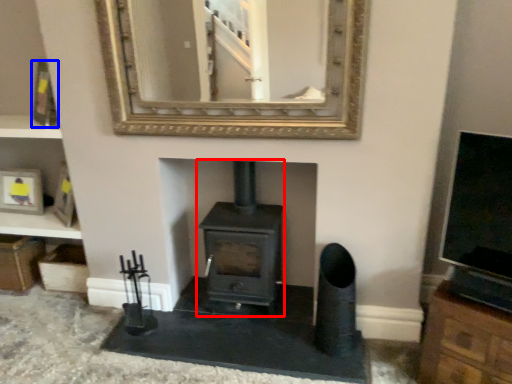
Question: Which of the following is the closest to the observer, wood burning stove (highlighted by a red box) or picture frame (highlighted by a blue box)?

Choices:
 (A) wood burning stove
 (B) picture frame

Answer: (A)